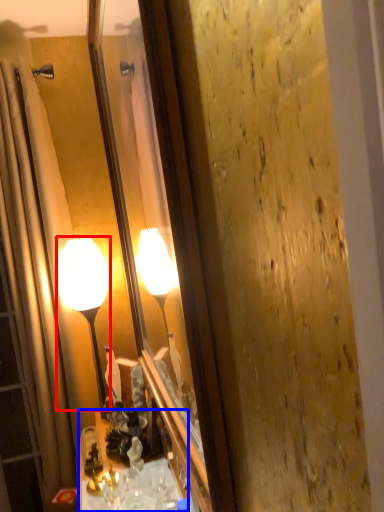
Question: Among these objects, which one is nearest to the camera, lamp (highlighted by a red box) or cabinetry (highlighted by a blue box)?

Choices:
 (A) lamp
 (B) cabinetry

Answer: (B)